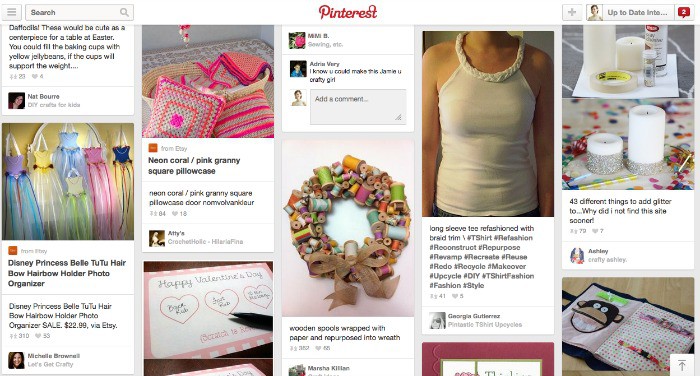
Identify the location of table top. (658, 288).